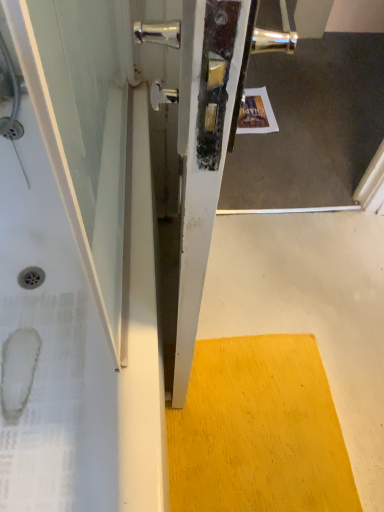
Question: Can you confirm if yellow textured mat at lower center is shorter than white glossy bathtub at left?

Choices:
 (A) no
 (B) yes

Answer: (B)

Question: Does yellow textured mat at lower center turn towards white glossy bathtub at left?

Choices:
 (A) no
 (B) yes

Answer: (A)

Question: From a real-world perspective, is yellow textured mat at lower center located beneath white glossy bathtub at left?

Choices:
 (A) no
 (B) yes

Answer: (B)

Question: Considering the relative sizes of yellow textured mat at lower center and white glossy bathtub at left in the image provided, is yellow textured mat at lower center taller than white glossy bathtub at left?

Choices:
 (A) yes
 (B) no

Answer: (B)

Question: Is yellow textured mat at lower center outside white glossy bathtub at left?

Choices:
 (A) yes
 (B) no

Answer: (A)

Question: Can you see yellow textured mat at lower center touching white glossy bathtub at left?

Choices:
 (A) no
 (B) yes

Answer: (A)

Question: Is white glossy bathtub at left further to camera compared to yellow textured mat at lower center?

Choices:
 (A) no
 (B) yes

Answer: (A)

Question: Considering the relative sizes of white glossy bathtub at left and yellow textured mat at lower center in the image provided, is white glossy bathtub at left smaller than yellow textured mat at lower center?

Choices:
 (A) no
 (B) yes

Answer: (A)

Question: From the image's perspective, would you say white glossy bathtub at left is positioned over yellow textured mat at lower center?

Choices:
 (A) no
 (B) yes

Answer: (B)

Question: Is white glossy bathtub at left to the left of yellow textured mat at lower center from the viewer's perspective?

Choices:
 (A) no
 (B) yes

Answer: (B)

Question: Is white glossy bathtub at left wider than yellow textured mat at lower center?

Choices:
 (A) yes
 (B) no

Answer: (A)

Question: Could you tell me if white glossy bathtub at left is turned towards yellow textured mat at lower center?

Choices:
 (A) yes
 (B) no

Answer: (B)

Question: From a real-world perspective, is yellow textured mat at lower center positioned above or below white glossy bathtub at left?

Choices:
 (A) below
 (B) above

Answer: (A)